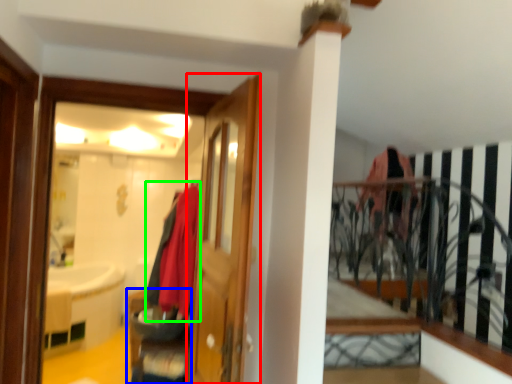
Question: Which object is positioned closest to door (highlighted by a red box)? Select from furniture (highlighted by a blue box) and clothing (highlighted by a green box).

Choices:
 (A) furniture
 (B) clothing

Answer: (B)